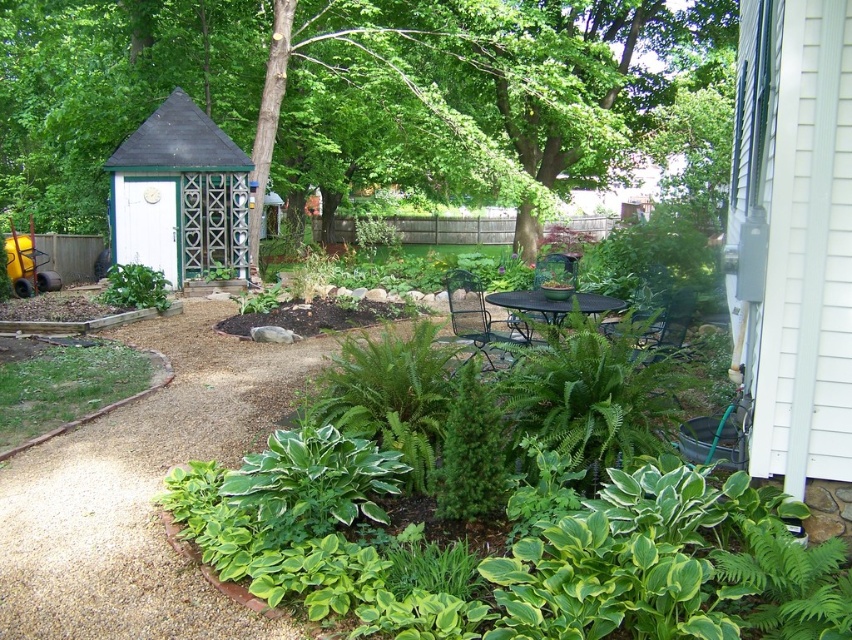
At what (x,y) coordinates should I click in order to perform the action: click on green leafy tree at center. Please return your answer as a coordinate pair (x, y). Looking at the image, I should click on (348, 92).

Which is in front, point (194, 32) or point (165, 268)?

Positioned in front is point (165, 268).

Does point (130, 108) come farther from viewer compared to point (165, 113)?

That is True.

Image resolution: width=852 pixels, height=640 pixels. I want to click on green leafy tree at center, so click(348, 92).